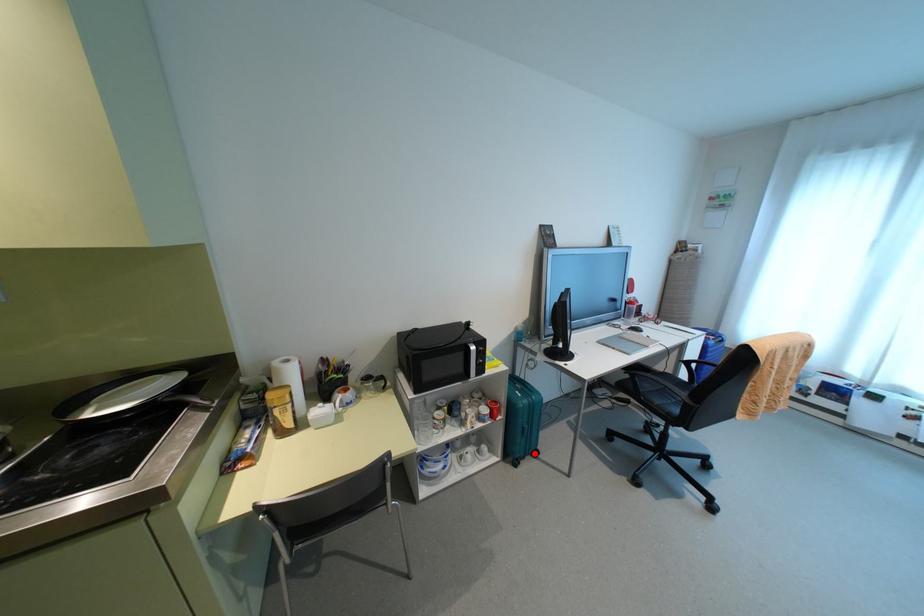
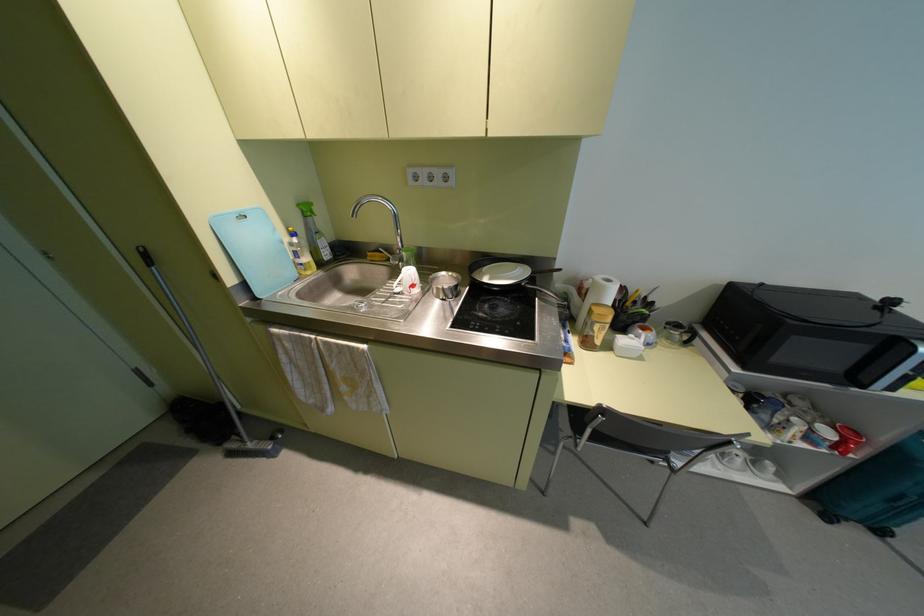
Question: I am providing you with two images of the same scene from different viewpoints. Image1 has a red point marked. In image2, the corresponding 3D location appears at what relative position? Reply with the corresponding letter.

Choices:
 (A) Closer
 (B) Farther

Answer: (A)